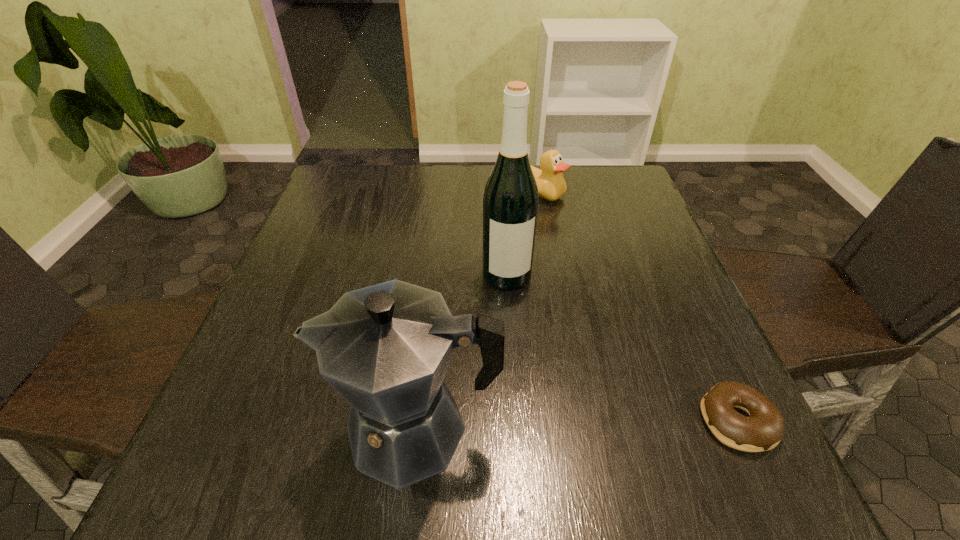
Identify the location of vacant area between the doughnut and the third nearest object. (622, 348).

The image size is (960, 540). Identify the location of empty space between the duck and the second tallest object. (477, 310).

You are a GUI agent. You are given a task and a screenshot of the screen. Output one action in this format:
    pyautogui.click(x=<x>, y=<y>)
    Task: Click on the closest object to the farthest object
    This screenshot has width=960, height=540.
    Given the screenshot: What is the action you would take?
    pyautogui.click(x=510, y=202)

Locate an element on the screen. The image size is (960, 540). object that is the third closest to the doughnut is located at coordinates (551, 184).